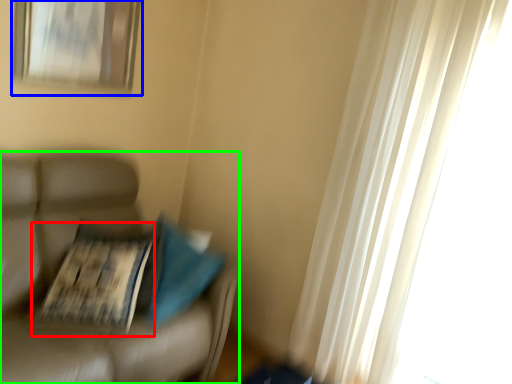
Question: Which is nearer to the magazine (highlighted by a red box)? picture frame (highlighted by a blue box) or furniture (highlighted by a green box).

Choices:
 (A) picture frame
 (B) furniture

Answer: (B)